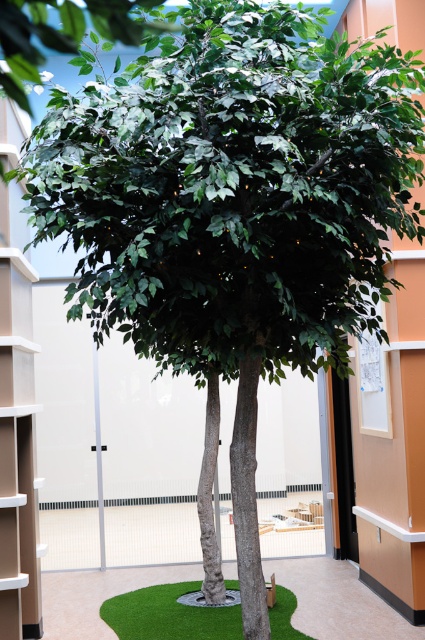
You are standing in the office and want to place a small potted plant between the green artificial turf at center and the green matte tree trunk at center. Which object should you place the plant closer to if you want it to be nearer to you?

You should place the plant closer to the green artificial turf at center because it is nearer to the viewer compared to the green matte tree trunk at center.

You are standing in the modern office and see the green artificial turf at center and the green matte tree trunk at center. Which object is positioned to the left of the other?

The green artificial turf at center is to the left of the green matte tree trunk at center.

You are standing at the entrance of the office and see two points marked on the floor. The first point is labeled as point [226,580] and the second is point [234,602]. If you walk towards the large artificial tree centrally placed, which point will you step on first?

Point [234,602] will be stepped on first because it is in front of point [226,580] according to their spatial arrangement.